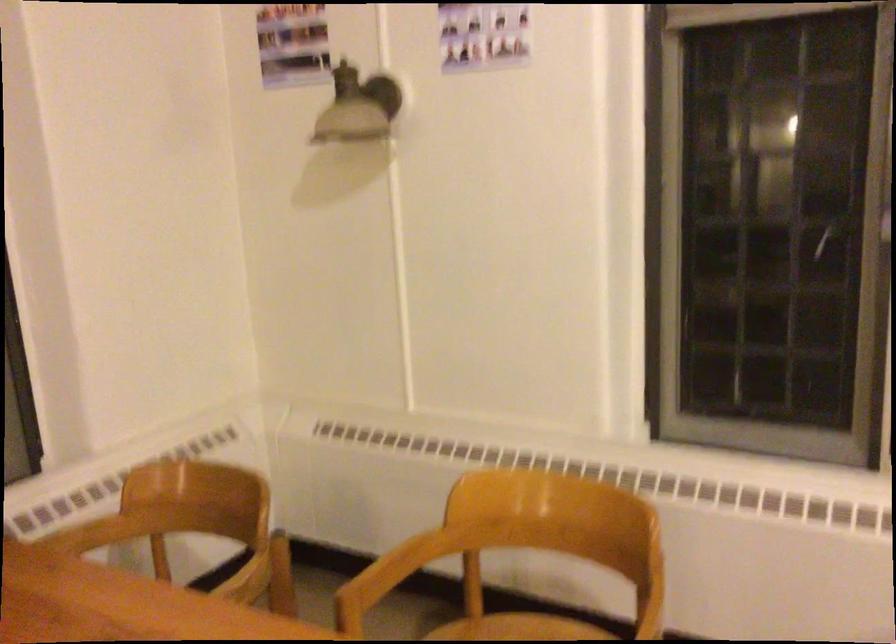
Identify the location of chair sitting surface. (517, 629).